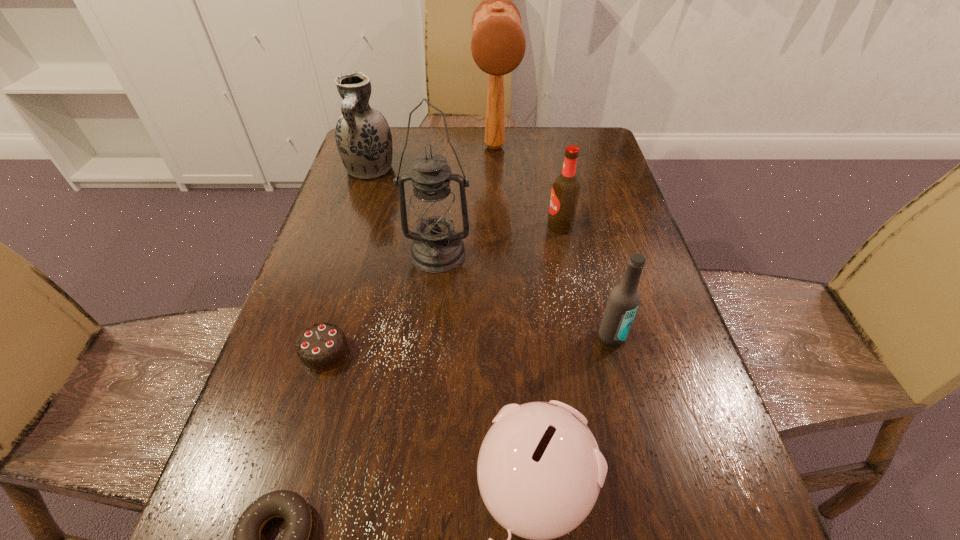
Locate an element on the screen. mallet is located at coordinates (498, 44).

Image resolution: width=960 pixels, height=540 pixels. I want to click on oil lamp, so click(x=437, y=248).

This screenshot has width=960, height=540. In order to click on vase in this screenshot , I will do `click(363, 137)`.

At what (x,y) coordinates should I click in order to perform the action: click on the farther beer bottle. Please return your answer as a coordinate pair (x, y). The height and width of the screenshot is (540, 960). Looking at the image, I should click on tap(565, 192).

Locate an element on the screen. This screenshot has height=540, width=960. the nearer beer bottle is located at coordinates (624, 298).

What are the coordinates of `the rightmost object` in the screenshot? It's located at (624, 298).

Locate an element on the screen. This screenshot has width=960, height=540. the second shortest object is located at coordinates (321, 347).

Image resolution: width=960 pixels, height=540 pixels. Identify the location of vacant space located on the strike surface of the mallet. (496, 192).

At what (x,y) coordinates should I click in order to perform the action: click on free space located 0.300m on the front of the oil lamp. Please return your answer as a coordinate pair (x, y). This screenshot has width=960, height=540. Looking at the image, I should click on (424, 394).

The image size is (960, 540). I want to click on vacant position located with the handle on the side of the vase, so click(335, 280).